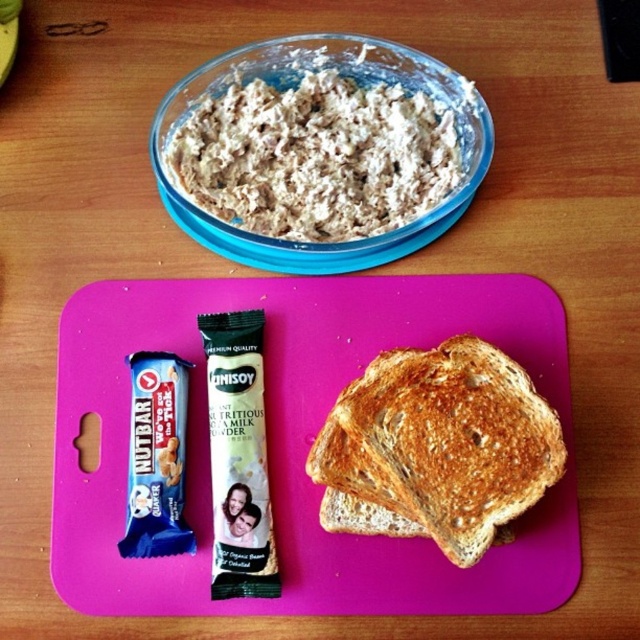
Looking at this image, who is more forward, (304, 416) or (177, 115)?

Point (304, 416) is in front.

Can you confirm if pink plastic cutting board at center is thinner than translucent glass bowl at upper center?

No, pink plastic cutting board at center is not thinner than translucent glass bowl at upper center.

Identify the location of pink plastic cutting board at center. (298, 444).

Who is positioned more to the right, golden brown toasted bread at center or translucent glass bowl at upper center?

Positioned to the right is golden brown toasted bread at center.

Does golden brown toasted bread at center have a lesser width compared to translucent glass bowl at upper center?

Yes.

The height and width of the screenshot is (640, 640). I want to click on golden brown toasted bread at center, so click(436, 448).

Where is `golden brown toasted bread at center`? golden brown toasted bread at center is located at coordinates (436, 448).

Does point (497, 284) come closer to viewer compared to point (10, 13)?

That is True.

Is pink plastic cutting board at center shorter than yellow matte banana at upper left?

No.

Where is `pink plastic cutting board at center`? pink plastic cutting board at center is located at coordinates (298, 444).

What are the coordinates of `pink plastic cutting board at center` in the screenshot? It's located at [x=298, y=444].